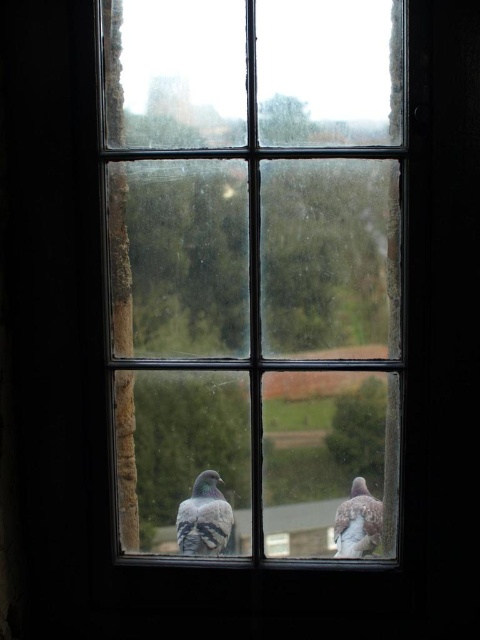
You are looking at the window and notice two points marked on it. Which point, point (391, 483) or point (372, 540), is closer to you?

Point (391, 483) is closer to the camera than point (372, 540), so it is closer to you.

You are an ornithologist observing birds through the clear glass window at center. You notice a speckled feathered bird at lower right. Can you determine if the bird is larger than the window?

The clear glass window at center is bigger than the speckled feathered bird at lower right, so the bird is smaller than the window.